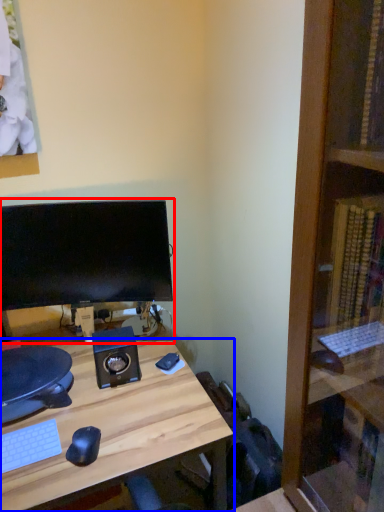
Question: Which of the following is the farthest to the observer, computer monitor (highlighted by a red box) or desk (highlighted by a blue box)?

Choices:
 (A) computer monitor
 (B) desk

Answer: (A)